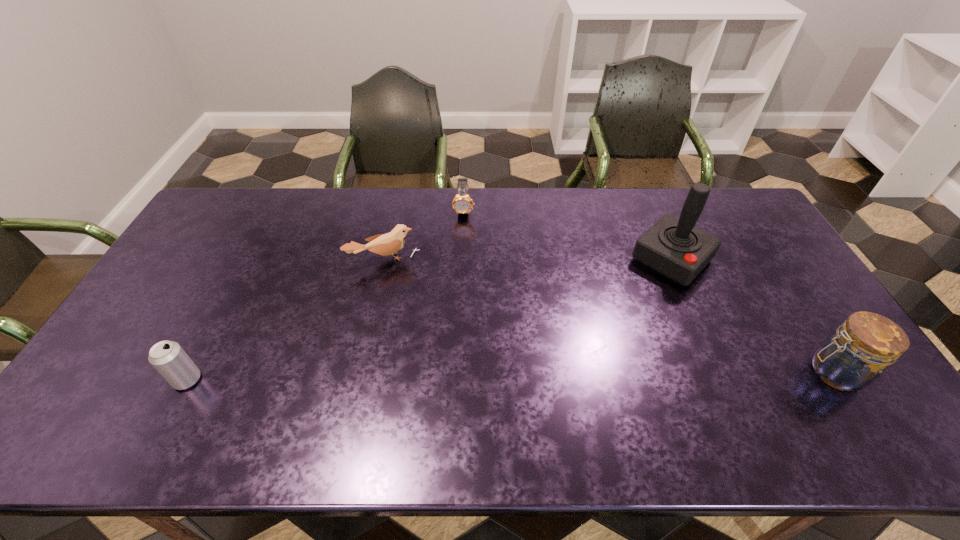
I want to click on vacant space situated 0.290m on the lid of the jar, so click(692, 373).

This screenshot has width=960, height=540. Identify the location of free space located 0.270m on the lid of the jar. (700, 373).

Locate an element on the screen. blank space located at the beak of the fourth object from right to left is located at coordinates (420, 343).

Where is `vacant space located 0.320m at the beak of the fourth object from right to left`? vacant space located 0.320m at the beak of the fourth object from right to left is located at coordinates [x=423, y=352].

This screenshot has width=960, height=540. I want to click on free space located 0.270m at the beak of the fourth object from right to left, so click(x=418, y=338).

Image resolution: width=960 pixels, height=540 pixels. I want to click on vacant space located 0.110m on the base of the tallest object, so click(632, 300).

Identify the location of vacant space located on the base of the tallest object. (614, 316).

Identify the location of free spot located 0.340m on the base of the tallest object. The width and height of the screenshot is (960, 540). (x=587, y=346).

This screenshot has width=960, height=540. In order to click on vacant space situated on the face of the watch in this screenshot , I will do `click(464, 270)`.

Locate an element on the screen. Image resolution: width=960 pixels, height=540 pixels. free point located on the face of the watch is located at coordinates (464, 268).